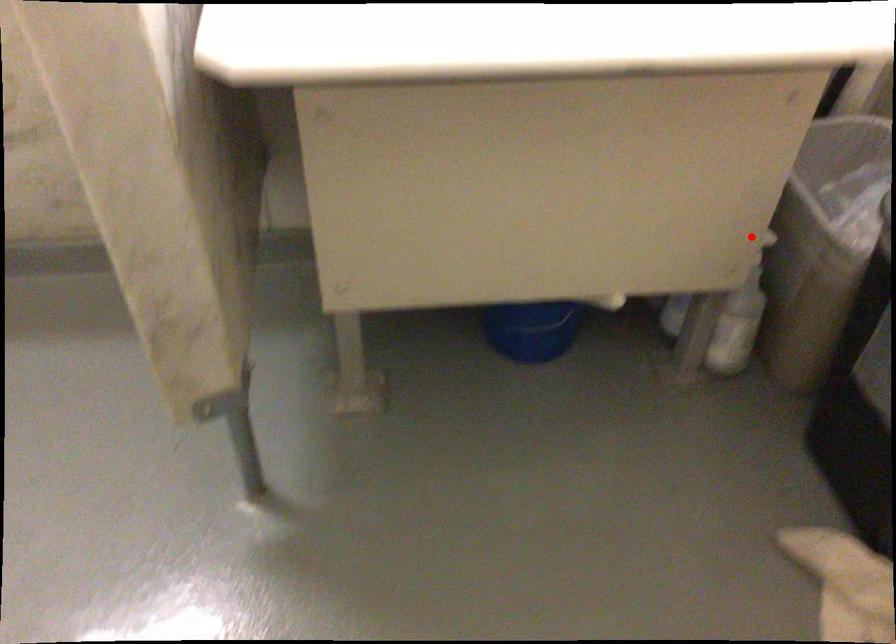
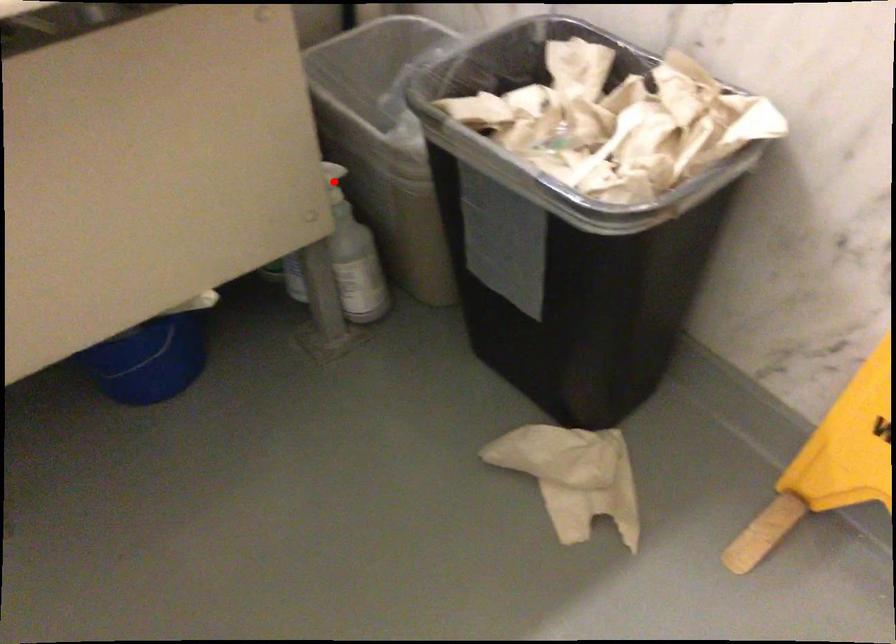
I am providing you with two images of the same scene from different viewpoints. A red point is marked on the first image and another point is marked on the second image. Do the highlighted points in image1 and image2 indicate the same real-world spot?

Yes